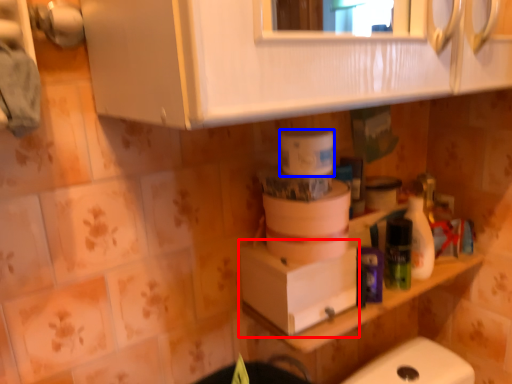
Question: Which of the following is the farthest to the observer, cardboard box (highlighted by a red box) or toilet paper (highlighted by a blue box)?

Choices:
 (A) cardboard box
 (B) toilet paper

Answer: (A)